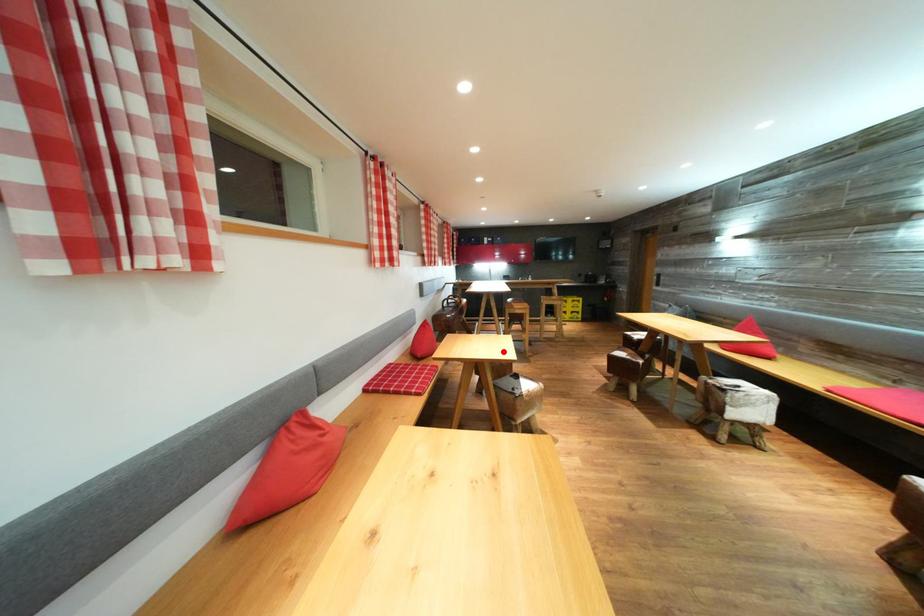
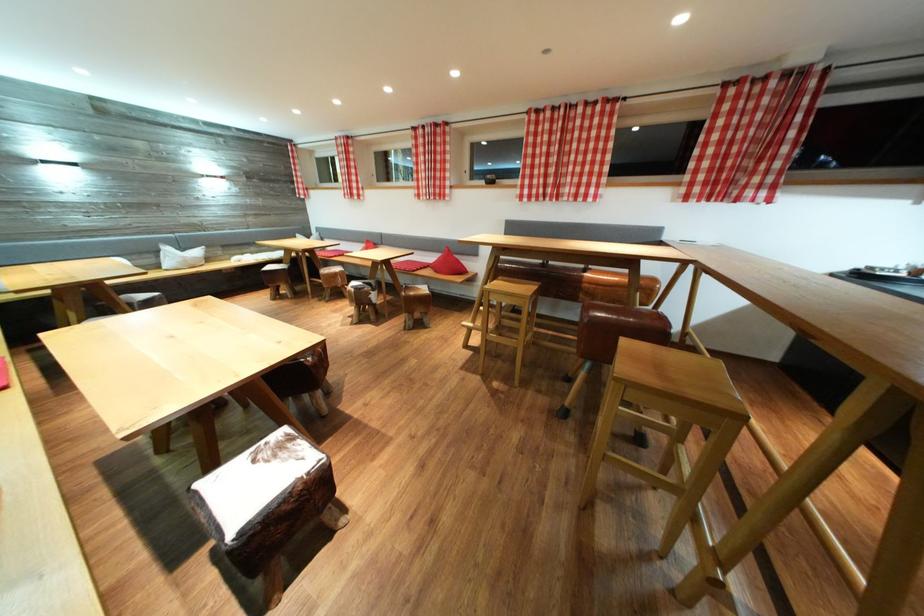
Question: I am providing you with two images of the same scene from different viewpoints. A red point is marked on the first image. At the location where the point appears in image 1, is it still visible in image 2?

Choices:
 (A) Yes
 (B) No

Answer: (B)